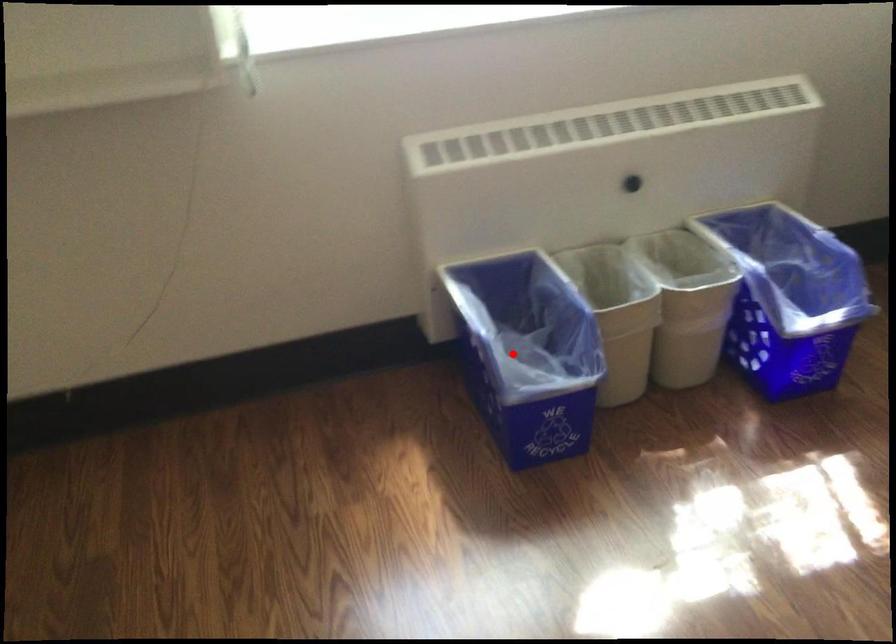
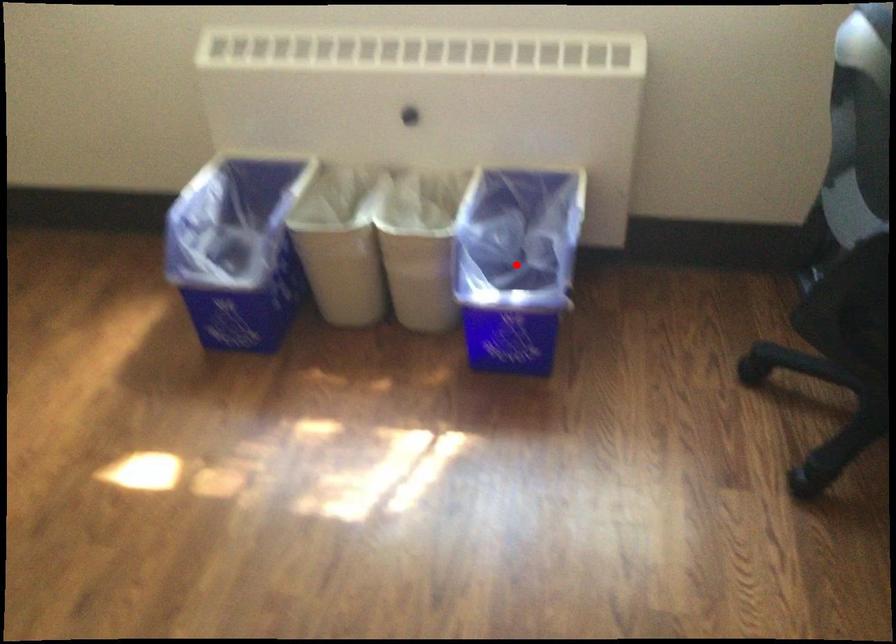
I am providing you with two images of the same scene from different viewpoints. A red point is marked on the first image and another point is marked on the second image. Does the point marked in image1 correspond to the same location as the one in image2?

No